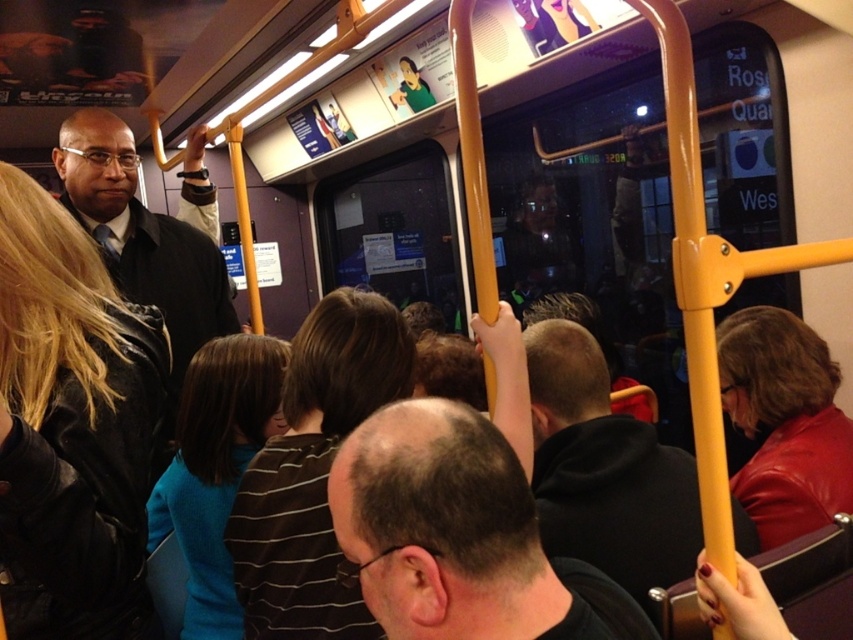
Measure the distance between black leather jacket at left and camera.

32.11 inches

Does black leather jacket at left have a lesser height compared to black hoodie at center?

Incorrect, black leather jacket at left's height does not fall short of black hoodie at center's.

Is point (108, 429) farther from viewer compared to point (575, 461)?

No, it is not.

Locate an element on the screen. This screenshot has width=853, height=640. black leather jacket at left is located at coordinates (71, 422).

What do you see at coordinates (459, 536) in the screenshot? I see `dark brown hair at center` at bounding box center [459, 536].

How distant is dark brown hair at center from black hoodie at center?

dark brown hair at center is 17.77 inches away from black hoodie at center.

Is point (393, 620) positioned behind point (659, 472)?

No, it is not.

Locate an element on the screen. This screenshot has width=853, height=640. dark brown hair at center is located at coordinates (459, 536).

Is point (496, 568) farther from camera compared to point (131, 256)?

That is False.

Does dark brown hair at center lie behind matte black suit at left?

No, dark brown hair at center is in front of matte black suit at left.

The image size is (853, 640). What do you see at coordinates (459, 536) in the screenshot? I see `dark brown hair at center` at bounding box center [459, 536].

Find the location of `dark brown hair at center`. dark brown hair at center is located at coordinates 459,536.